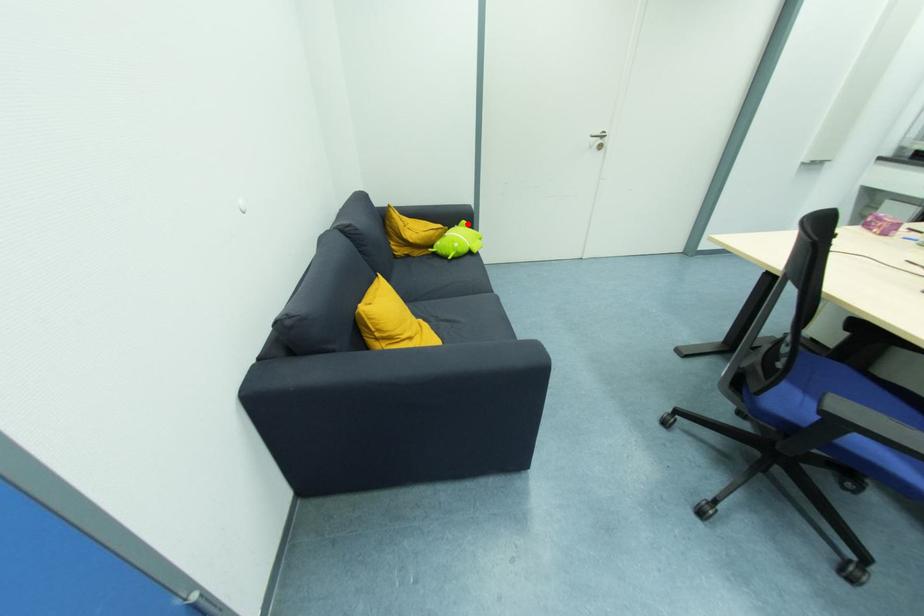
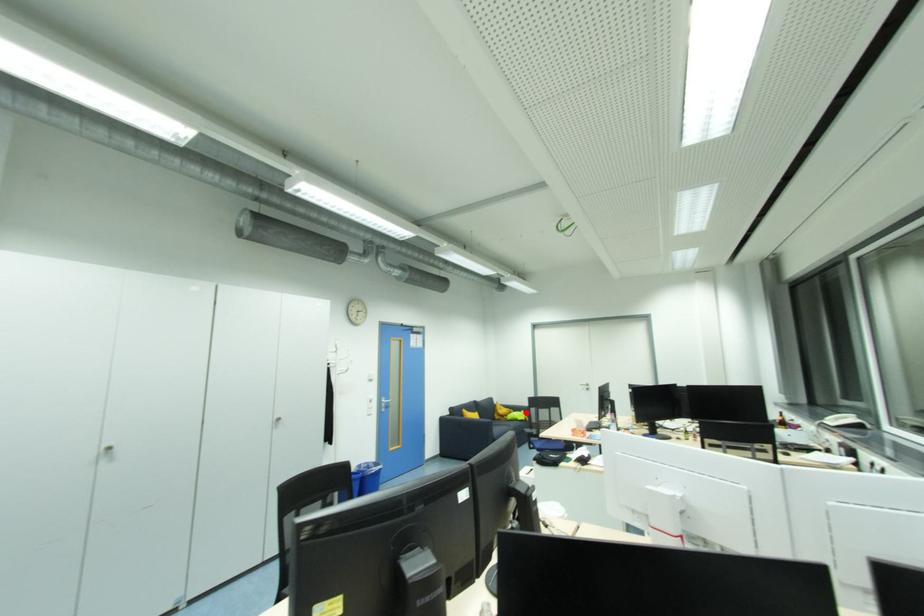
I am providing you with two images of the same scene from different viewpoints. A red point is marked on the first image and another point is marked on the second image. Is the red point in image1 aligned with the point shown in image2?

Yes